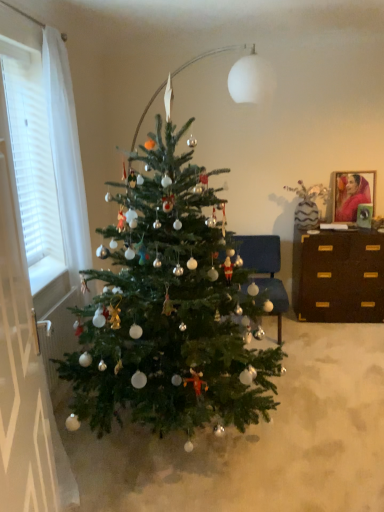
Question: Considering the relative positions of green matte christmas tree at center and brown wood desk at right in the image provided, is green matte christmas tree at center to the right of brown wood desk at right from the viewer's perspective?

Choices:
 (A) yes
 (B) no

Answer: (B)

Question: From a real-world perspective, is green matte christmas tree at center on top of brown wood desk at right?

Choices:
 (A) yes
 (B) no

Answer: (A)

Question: Does green matte christmas tree at center lie behind brown wood desk at right?

Choices:
 (A) no
 (B) yes

Answer: (A)

Question: Is green matte christmas tree at center shorter than brown wood desk at right?

Choices:
 (A) yes
 (B) no

Answer: (B)

Question: Would you say brown wood desk at right is part of green matte christmas tree at center's contents?

Choices:
 (A) yes
 (B) no

Answer: (B)

Question: Does green matte christmas tree at center have a smaller size compared to brown wood desk at right?

Choices:
 (A) yes
 (B) no

Answer: (B)

Question: Is matte red fabric portrait at upper right directly adjacent to white textured curtain at left?

Choices:
 (A) yes
 (B) no

Answer: (B)

Question: From the image's perspective, would you say matte red fabric portrait at upper right is shown under white textured curtain at left?

Choices:
 (A) no
 (B) yes

Answer: (A)

Question: Is the position of matte red fabric portrait at upper right more distant than that of white textured curtain at left?

Choices:
 (A) yes
 (B) no

Answer: (A)

Question: Is matte red fabric portrait at upper right facing towards white textured curtain at left?

Choices:
 (A) no
 (B) yes

Answer: (A)

Question: Is matte red fabric portrait at upper right bigger than white textured curtain at left?

Choices:
 (A) no
 (B) yes

Answer: (A)

Question: Is white textured curtain at left a part of matte red fabric portrait at upper right?

Choices:
 (A) yes
 (B) no

Answer: (B)

Question: Does blue fabric chair at center turn towards green matte christmas tree at center?

Choices:
 (A) no
 (B) yes

Answer: (B)